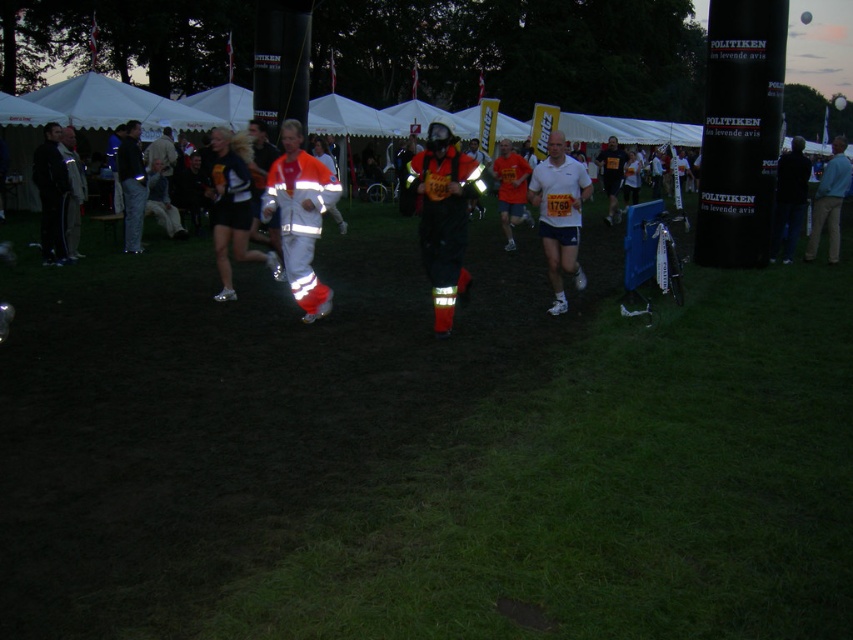
You are a participant in the nighttime race and want to check the distance to the reflective white santa at center from your current position. Can you estimate whether you are closer than 8 meters to it?

The reflective white santa at center is 7.69 meters from viewer, so yes, you are closer than 8 meters to it.

You are a photographer at the nighttime event. You need to capture a photo of the reflective white santa at center and the white matte shirt at center. Which one should you focus on first if you want to include both in the frame without moving the camera?

The reflective white santa at center should be focused on first because it is positioned on the left side of the white matte shirt at center, so adjusting focus to the left ensures both are in the frame.

You are a photographer positioned at the back of the field. You want to take a photo of the reflective white santa at center and the white matte shirt at center. Which object will appear larger in your photo?

The reflective white santa at center will appear larger in the photo because it is closer to the viewer than the white matte shirt at center.